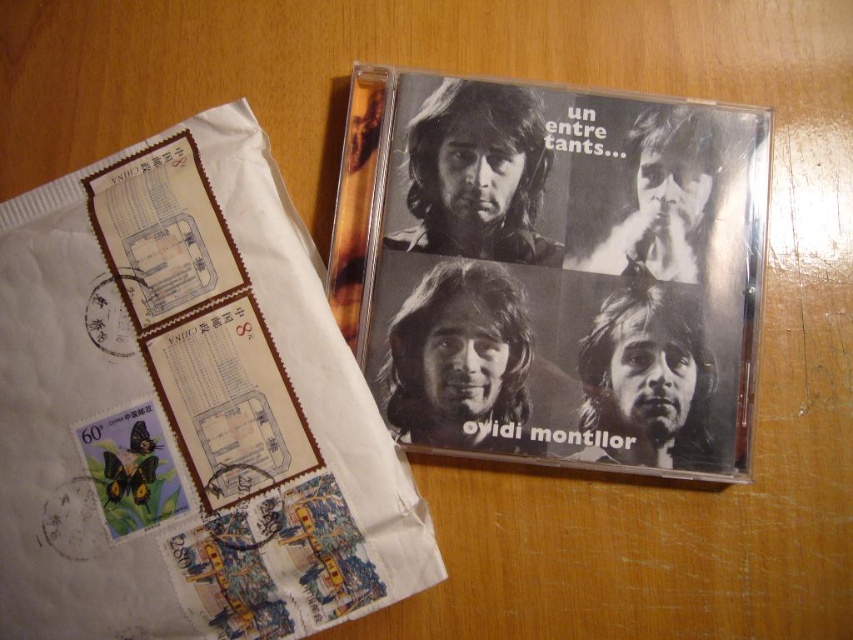
Question: Considering the relative positions of black matte cd at upper left and black matte cd at upper right in the image provided, where is black matte cd at upper left located with respect to black matte cd at upper right?

Choices:
 (A) above
 (B) below

Answer: (B)

Question: Does black matte cd at upper left appear under black matte cd at upper right?

Choices:
 (A) yes
 (B) no

Answer: (A)

Question: Which of the following is the farthest from the observer?

Choices:
 (A) black matte cd at upper right
 (B) black matte cd at upper left

Answer: (A)

Question: Does black matte cd at upper left have a smaller size compared to black matte cd at upper right?

Choices:
 (A) no
 (B) yes

Answer: (A)

Question: Among these objects, which one is farthest from the camera?

Choices:
 (A) black matte cd at upper left
 (B) black matte cd at upper right

Answer: (B)